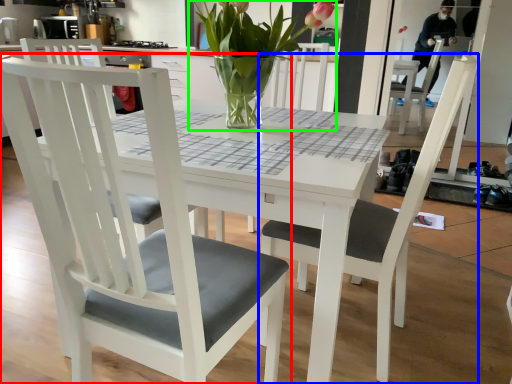
Question: Estimate the real-world distances between objects in this image. Which object is closer to chair (highlighted by a red box), chair (highlighted by a blue box) or houseplant (highlighted by a green box)?

Choices:
 (A) chair
 (B) houseplant

Answer: (A)